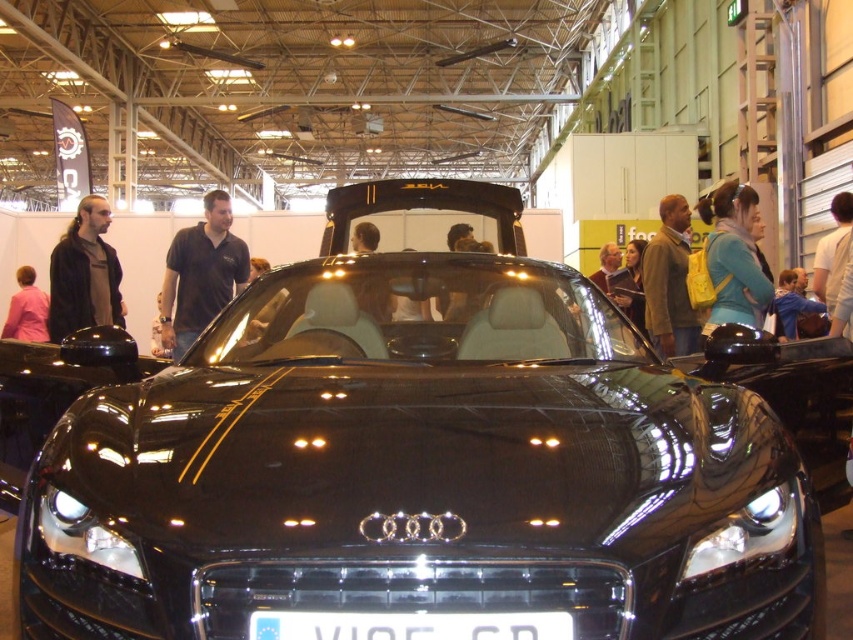
This screenshot has height=640, width=853. Describe the element at coordinates (409, 625) in the screenshot. I see `white plastic license plate at center` at that location.

Is point (345, 627) positioned before point (721, 227)?

That is True.

I want to click on white plastic license plate at center, so click(x=409, y=625).

Find the location of `white plastic license plate at center`. white plastic license plate at center is located at coordinates (409, 625).

Does point (434, 616) come behind point (74, 298)?

That is False.

This screenshot has height=640, width=853. I want to click on white plastic license plate at center, so click(409, 625).

Between pink fabric at lower left and blue fabric jacket at center, which one has less height?

With less height is blue fabric jacket at center.

Can you confirm if pink fabric at lower left is thinner than blue fabric jacket at center?

Indeed, pink fabric at lower left has a lesser width compared to blue fabric jacket at center.

Who is more forward, (42, 317) or (795, 278)?

Point (42, 317) is in front.

This screenshot has height=640, width=853. What are the coordinates of `pink fabric at lower left` in the screenshot? It's located at (26, 308).